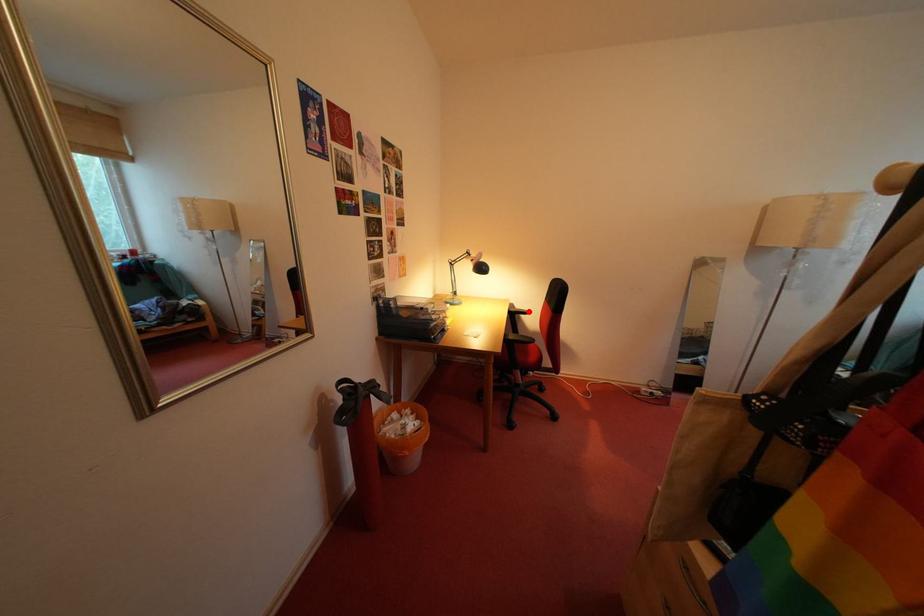
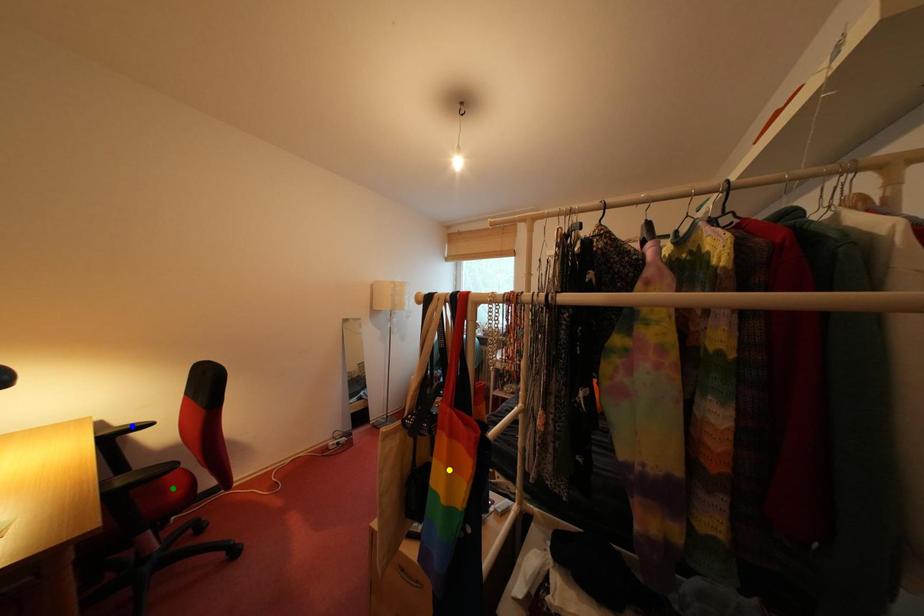
Question: I am providing you with two images of the same scene from different viewpoints. A red point is marked on the first image. You are given multiple points on the second image. In image 2, which mark is for the same physical point as the one in image 1?

Choices:
 (A) yellow point
 (B) blue point
 (C) green point

Answer: (B)